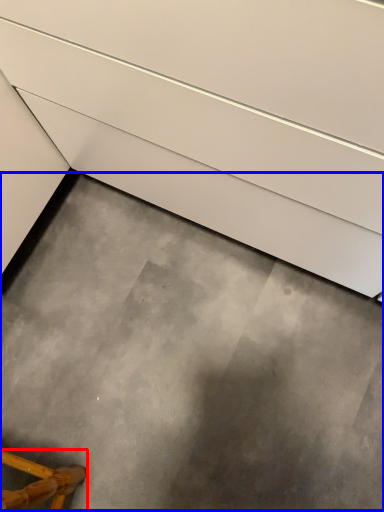
Question: Which point is closer to the camera, furniture (highlighted by a red box) or concrete (highlighted by a blue box)?

Choices:
 (A) furniture
 (B) concrete

Answer: (A)